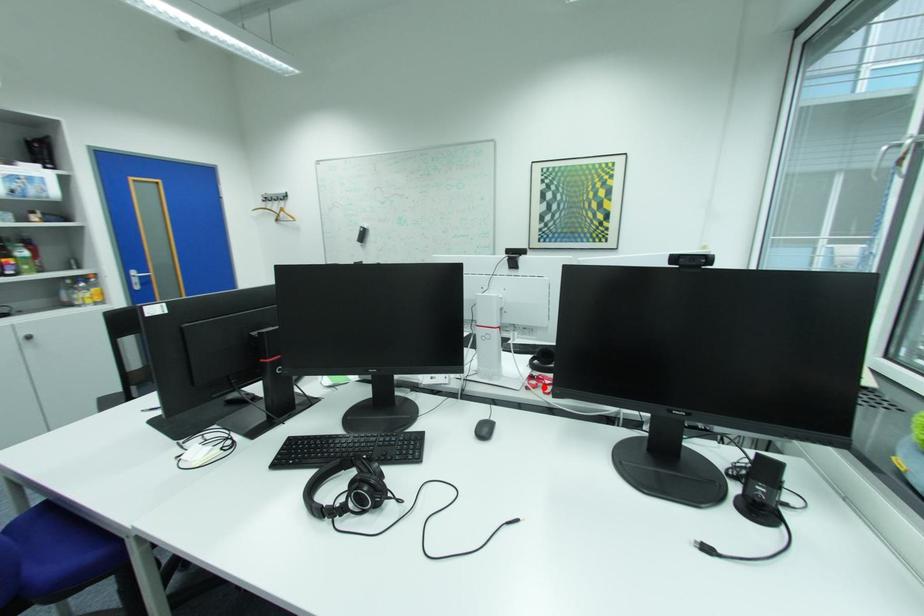
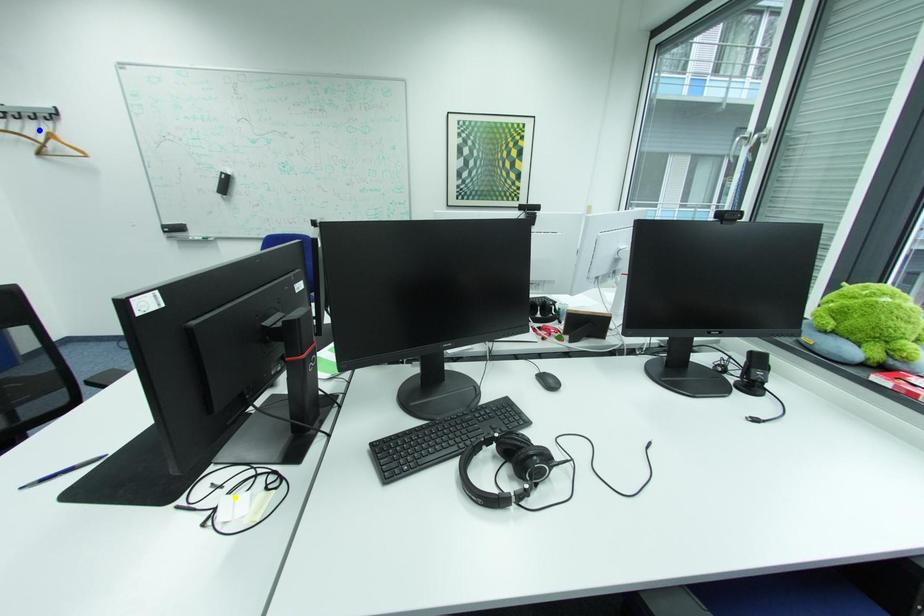
Question: I am providing you with two images of the same scene from different viewpoints. A red point is marked on the first image. You are given multiple points on the second image. In image 2, which mark is for the same physical point as the one in image 1?

Choices:
 (A) green point
 (B) yellow point
 (C) blue point

Answer: (A)